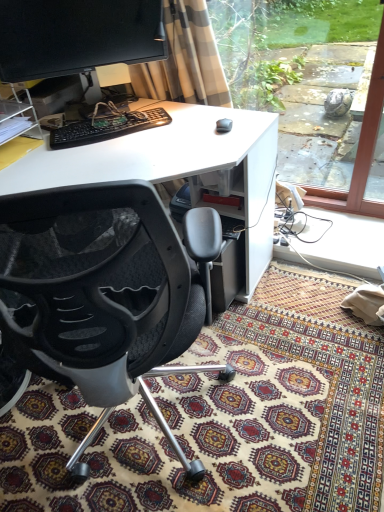
Where is `empty space that is ontop of white plastic desk at center (from a real-world perspective)`? Image resolution: width=384 pixels, height=512 pixels. empty space that is ontop of white plastic desk at center (from a real-world perspective) is located at coordinates (114, 145).